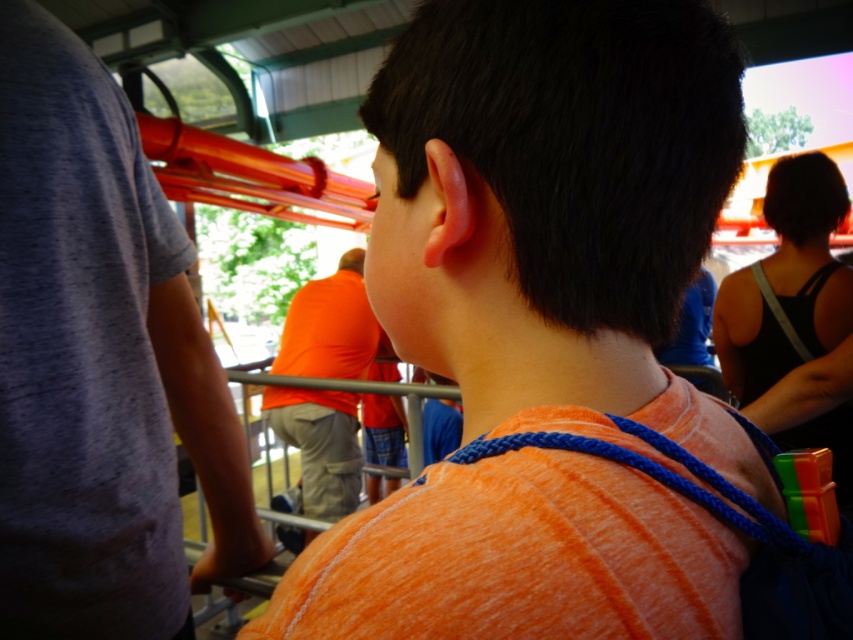
Describe the element at coordinates (99, 362) in the screenshot. Image resolution: width=853 pixels, height=640 pixels. I see `gray cotton t-shirt at upper left` at that location.

Is gray cotton t-shirt at upper left taller than orange cotton shirt at center?

Incorrect, gray cotton t-shirt at upper left's height is not larger of orange cotton shirt at center's.

Who is more distant from viewer, [32,180] or [312,531]?

The point [312,531] is more distant.

In order to click on gray cotton t-shirt at upper left in this screenshot , I will do `click(99, 362)`.

The image size is (853, 640). Describe the element at coordinates (556, 212) in the screenshot. I see `orange fabric shirt at center` at that location.

This screenshot has height=640, width=853. I want to click on orange fabric shirt at center, so click(556, 212).

Between orange fabric shirt at center and orange cotton shirt at center, which one is positioned higher?

Positioned higher is orange fabric shirt at center.

Measure the distance between orange fabric shirt at center and orange cotton shirt at center.

orange fabric shirt at center is 6.80 feet from orange cotton shirt at center.

Find the location of a particular element. This screenshot has height=640, width=853. orange fabric shirt at center is located at coordinates (556, 212).

Image resolution: width=853 pixels, height=640 pixels. I want to click on orange fabric shirt at center, so click(x=556, y=212).